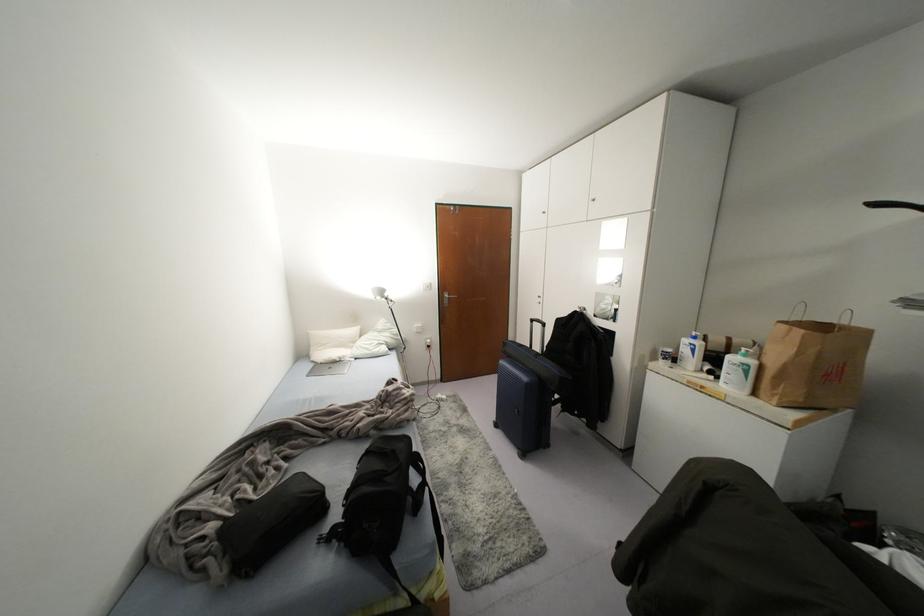
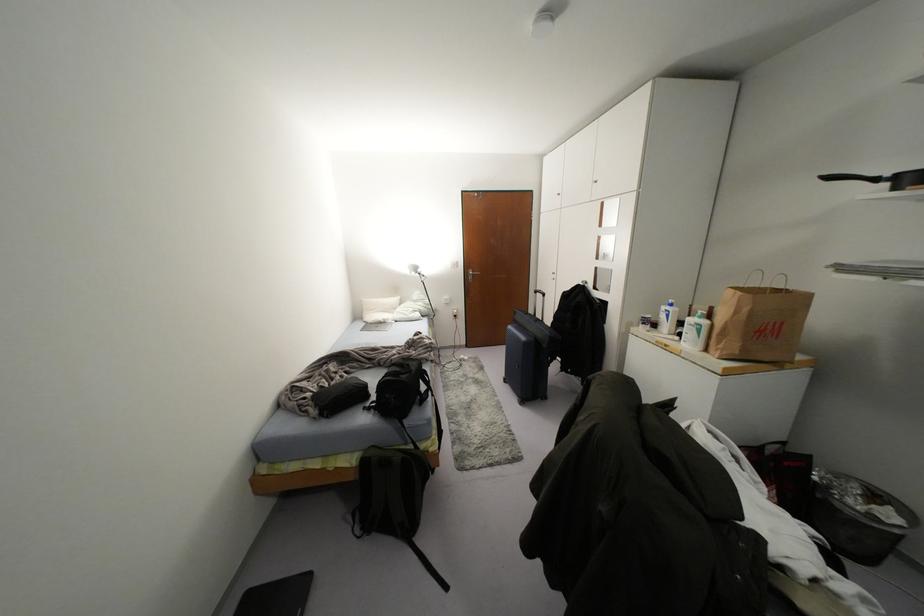
In the second image, find the point that corresponds to point 429,286 in the first image.

(456, 264)